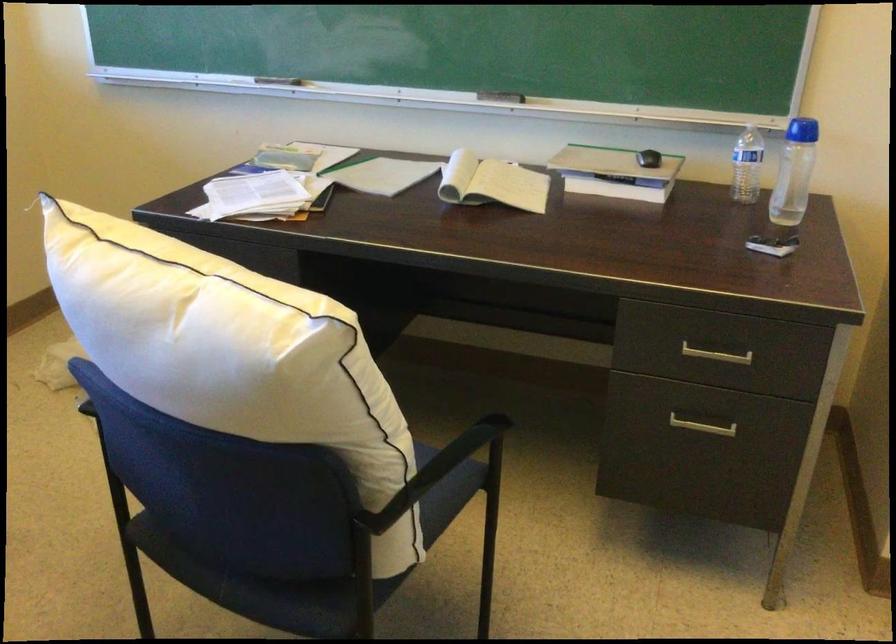
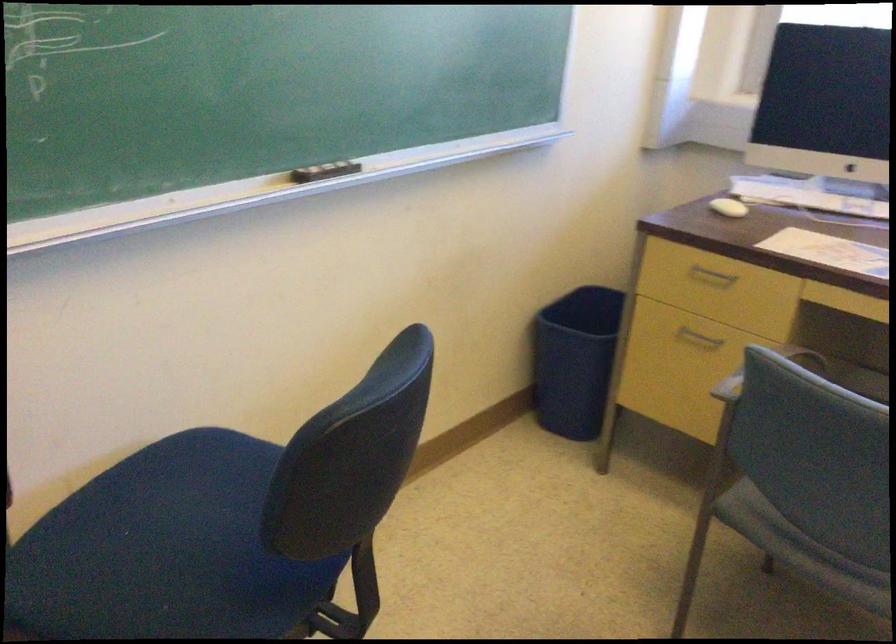
How did the camera likely rotate?

The camera's rotation is toward left-down.